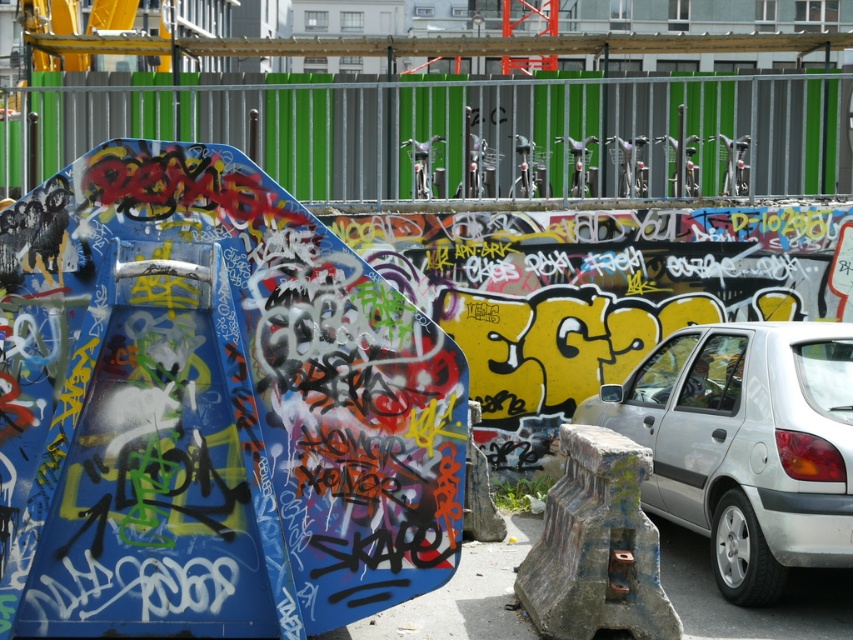
Question: From the image, what is the correct spatial relationship of metallic silver fence at upper center in relation to silver metallic car at right?

Choices:
 (A) left
 (B) right

Answer: (A)

Question: Does metallic silver fence at upper center have a larger size compared to silver metallic car at right?

Choices:
 (A) no
 (B) yes

Answer: (A)

Question: Can you confirm if metallic silver fence at upper center is thinner than silver metallic car at right?

Choices:
 (A) yes
 (B) no

Answer: (A)

Question: Which point is farther from the camera taking this photo?

Choices:
 (A) click(x=196, y=106)
 (B) click(x=811, y=355)

Answer: (A)

Question: Which of the following is the closest to the observer?

Choices:
 (A) (747, 339)
 (B) (306, 196)

Answer: (A)